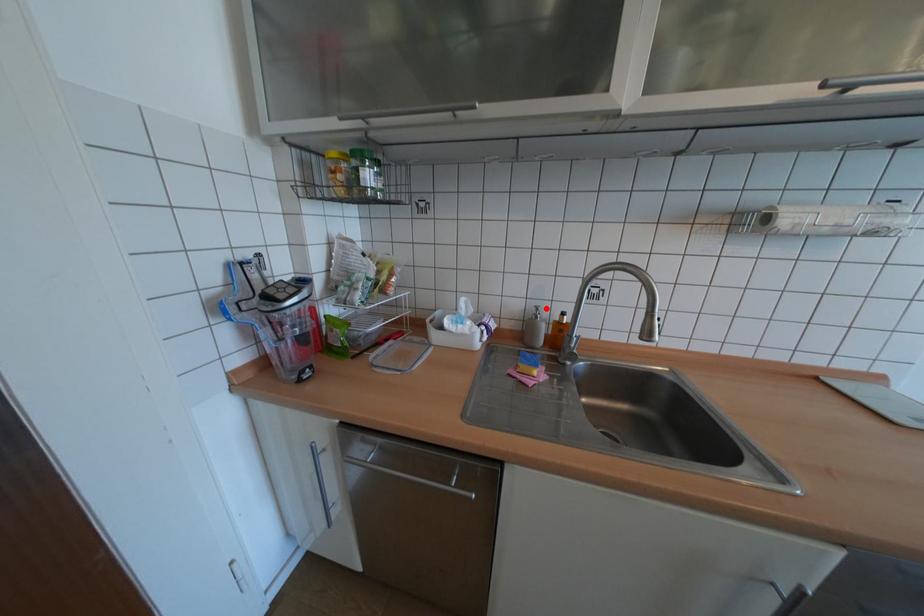
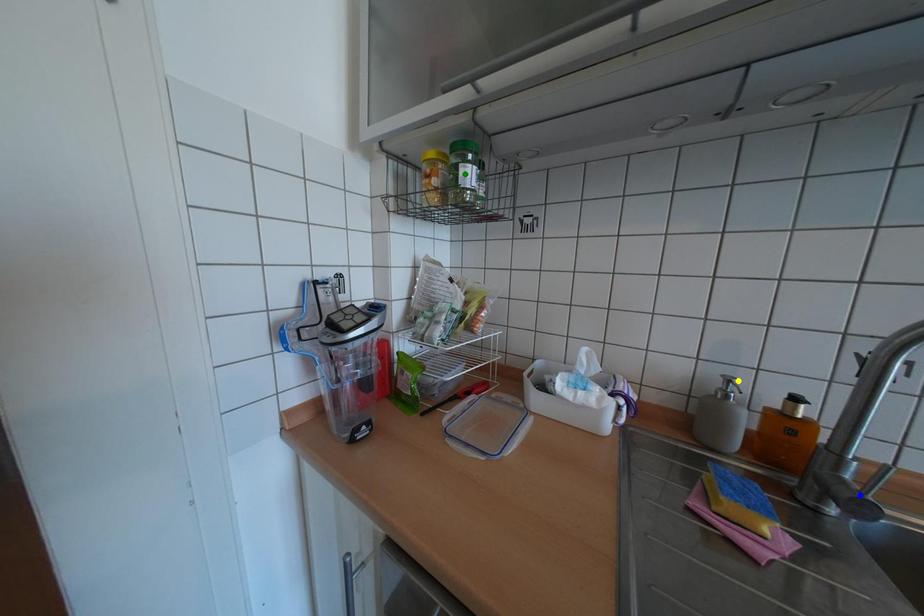
Question: I am providing you with two images of the same scene from different viewpoints. A red point is marked on the first image. You are given multiple points on the second image. In image 2, which mark is for the same physical point as the one in image 1?

Choices:
 (A) green point
 (B) yellow point
 (C) blue point

Answer: (B)